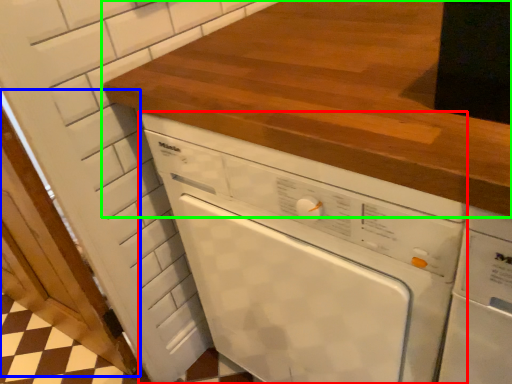
Question: Based on their relative distances, which object is farther from home appliance (highlighted by a red box)? Choose from door (highlighted by a blue box) and countertop (highlighted by a green box).

Choices:
 (A) door
 (B) countertop

Answer: (A)